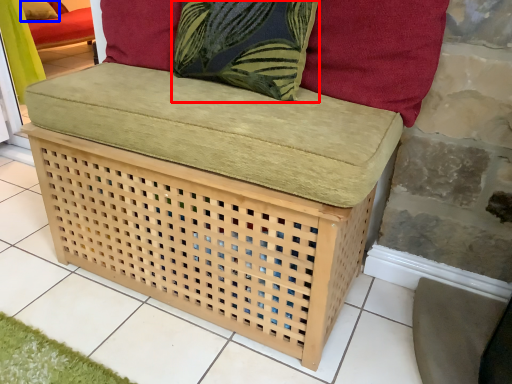
Question: Among these objects, which one is nearest to the camera, throw pillow (highlighted by a red box) or pillow (highlighted by a blue box)?

Choices:
 (A) throw pillow
 (B) pillow

Answer: (A)